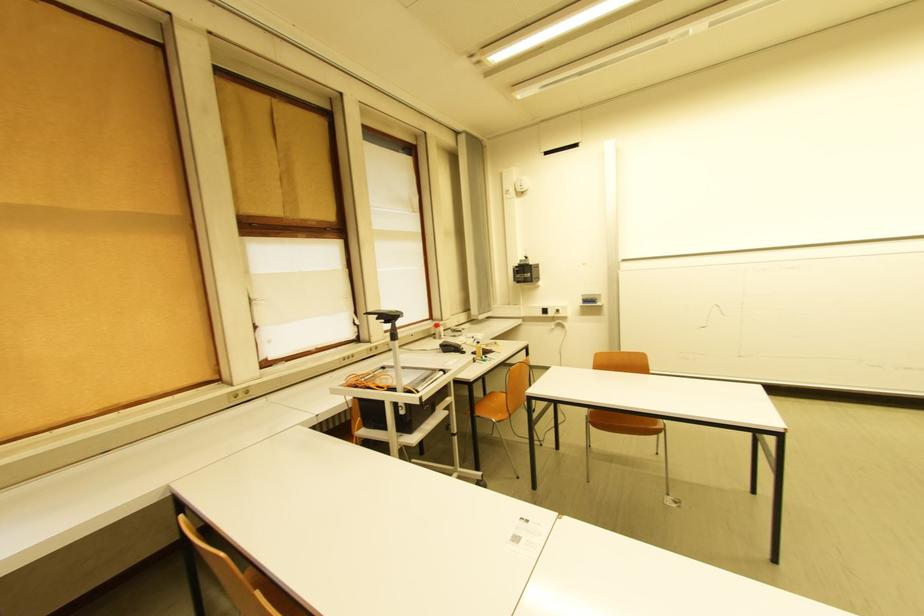
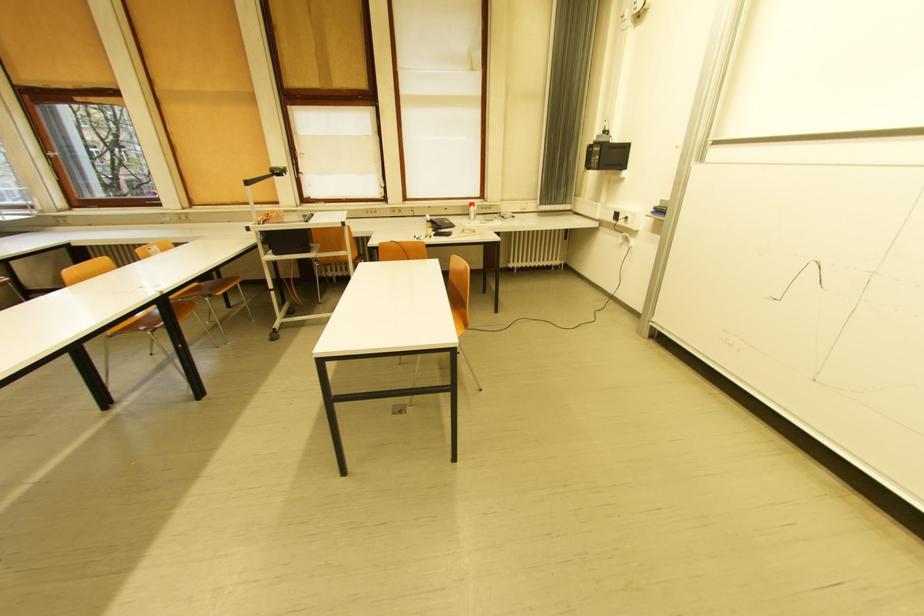
Locate, in the second image, the point that corresponds to the point at 431,331 in the first image.

(469, 208)